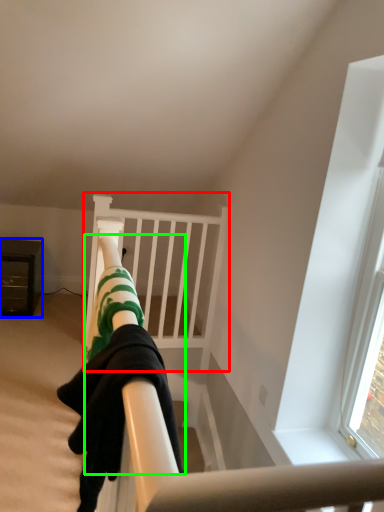
Question: Which is nearer to the bunk bed (highlighted by a red box)? furniture (highlighted by a blue box) or person (highlighted by a green box).

Choices:
 (A) furniture
 (B) person

Answer: (A)